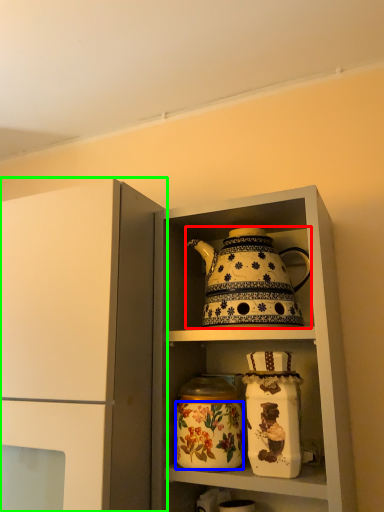
Question: Based on their relative distances, which object is nearer to kettle (highlighted by a red box)? Choose from flower (highlighted by a blue box) and cupboard (highlighted by a green box).

Choices:
 (A) flower
 (B) cupboard

Answer: (A)